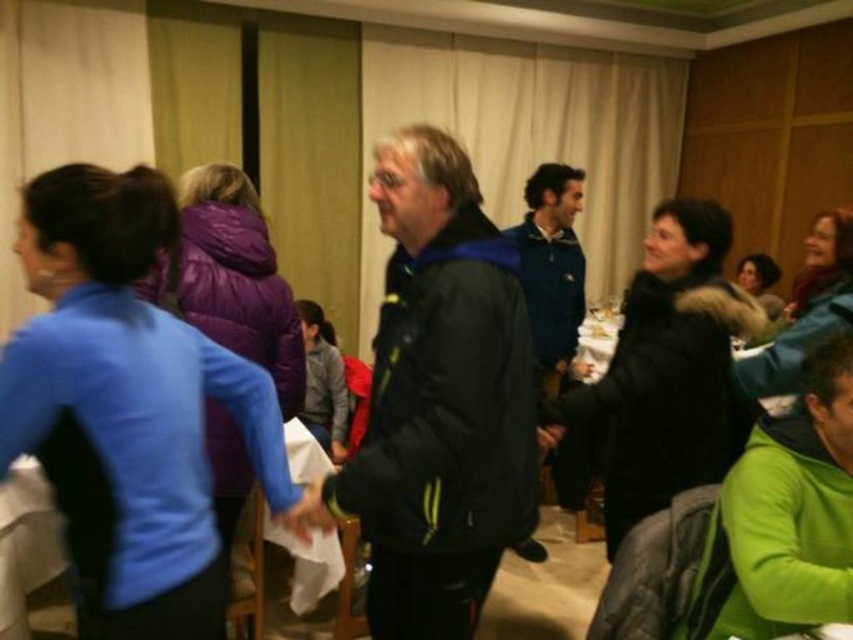
Question: Does green fleece jacket at lower right have a larger size compared to blue fleece jacket at center?

Choices:
 (A) yes
 (B) no

Answer: (B)

Question: Which point appears closest to the camera in this image?

Choices:
 (A) (491, 502)
 (B) (788, 547)

Answer: (B)

Question: Which point is farther from the camera taking this photo?

Choices:
 (A) (578, 285)
 (B) (45, 486)
 (C) (730, 497)
 (D) (431, 536)

Answer: (A)

Question: Can you confirm if black jacket at center is thinner than green fleece jacket at lower right?

Choices:
 (A) no
 (B) yes

Answer: (A)

Question: Which object appears closest to the camera in this image?

Choices:
 (A) white paper at center
 (B) black fuzzy jacket at center
 (C) green fleece jacket at lower right
 (D) black jacket at center

Answer: (C)

Question: Does black fuzzy jacket at center appear under blue fleece jacket at center?

Choices:
 (A) yes
 (B) no

Answer: (A)